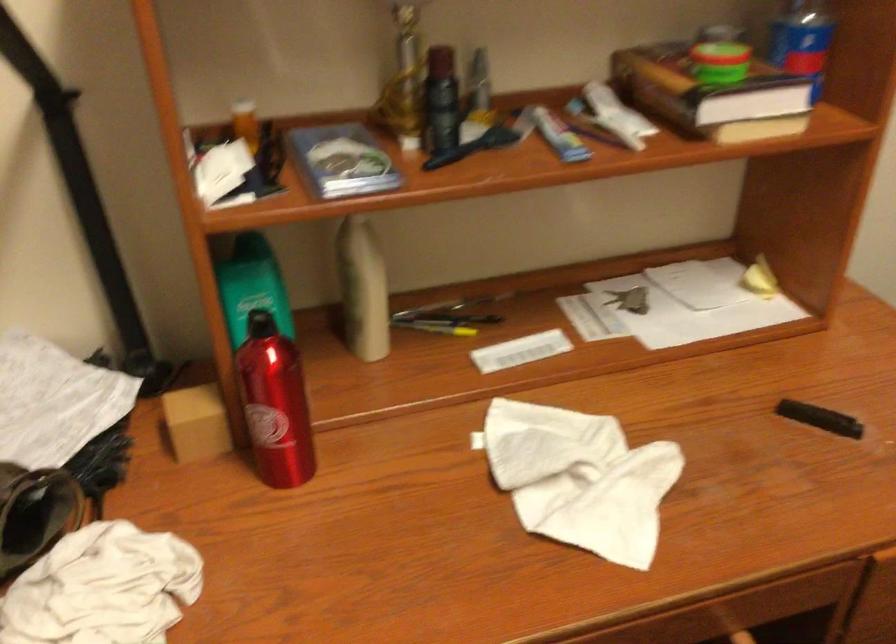
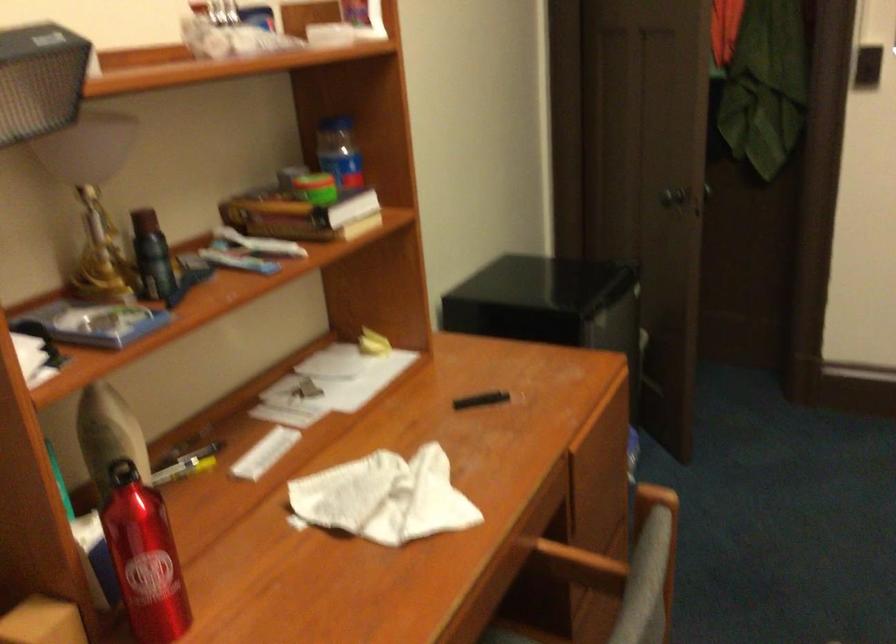
Locate, in the second image, the point that corresponds to the point at 255,410 in the first image.

(143, 558)